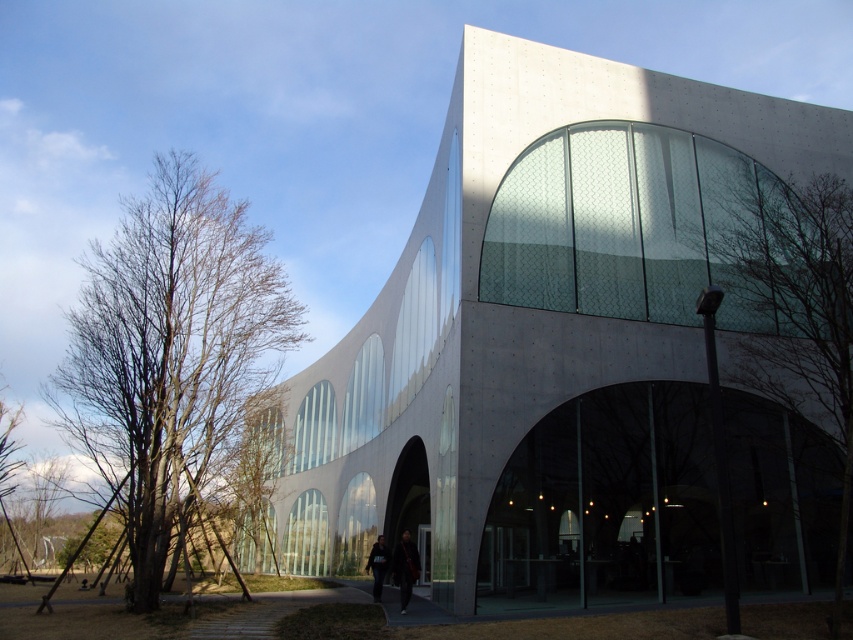
You are standing at the point marked as point (817, 481). You want to walk to the nearest emergency exit, which is located at the other end of the building. Given that the distance between you and the exit is 84.75 feet, can you estimate how many minutes it would take you to walk there at a normal pace of 3 feet per second?

The distance between point (817, 481) and the emergency exit is 84.75 feet. At a normal walking pace of 3 feet per second, it would take approximately 28.25 seconds, which is about 0.47 minutes. However, since the question asks for minutes, rounding to the nearest whole number would give roughly 0.5 minutes or 30 seconds.

Looking at this image, you are an interior designer assessing the space. You have a dark gray fabric jacket at center and a bare wood tree at left. Which object is wider?

The bare wood tree at left is wider than the dark gray fabric jacket at center.

In the scene shown: You are standing in front of the white concrete building at center and the dark gray jacket at center. Which object is taller?

The white concrete building at center is much taller than the dark gray jacket at center.